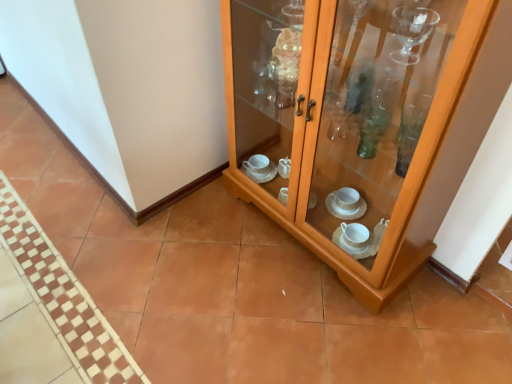
Where is `vacant area to the left of wooden cabinet at center`? This screenshot has width=512, height=384. vacant area to the left of wooden cabinet at center is located at coordinates (193, 251).